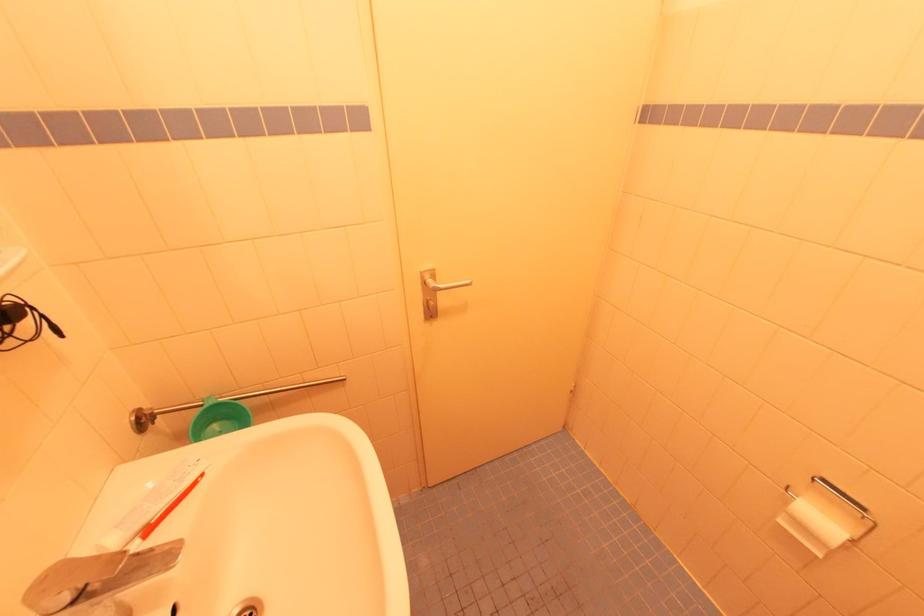
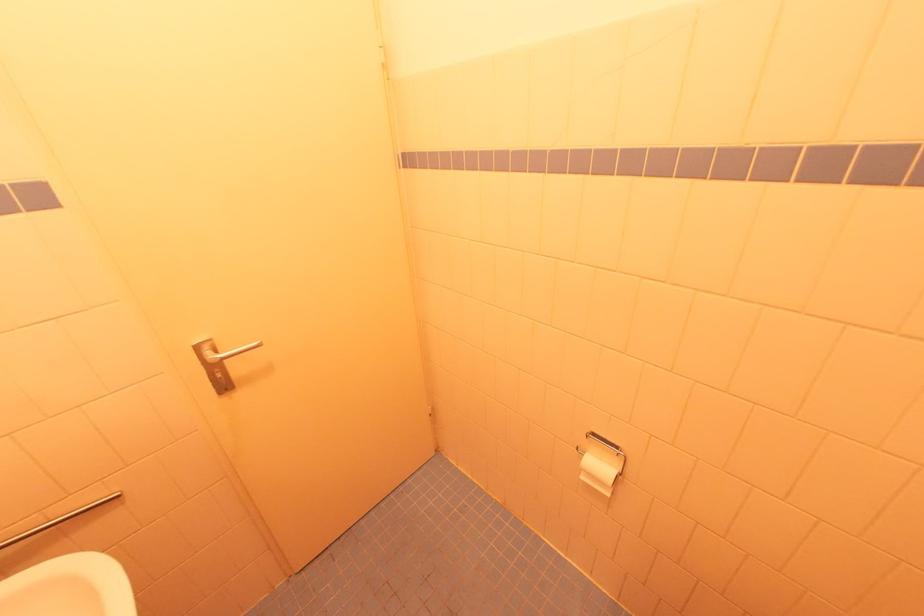
In the second image, find the point that corresponds to the point at 784,523 in the first image.

(585, 479)